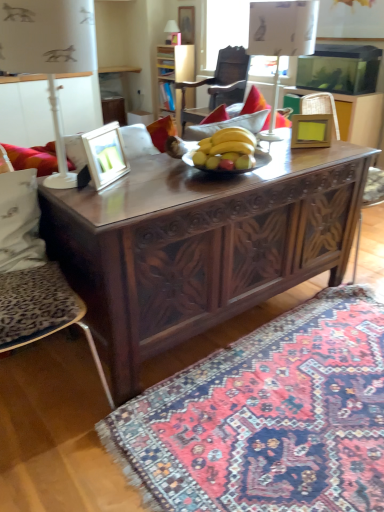
Identify the location of spots to the right of matte wooden picture frame at left, acting as the third picture frame starting from the top. (152, 176).